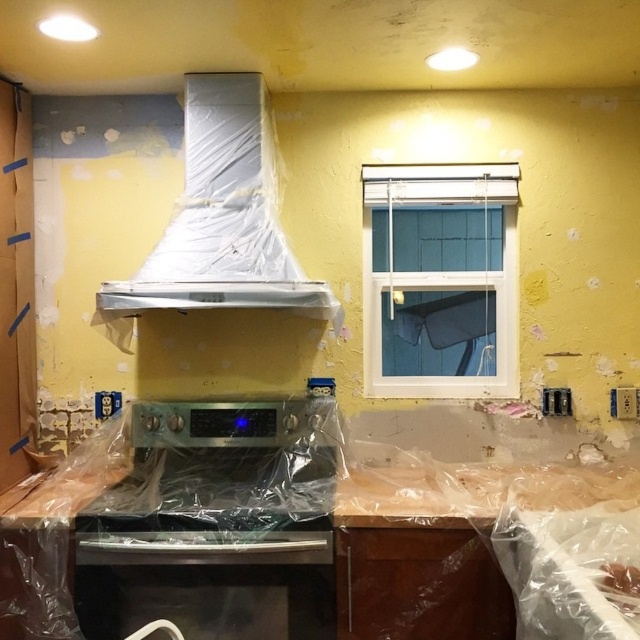
How far apart are satin silver oven at center and white plastic exhaust hood at upper center?

satin silver oven at center is 24.79 inches away from white plastic exhaust hood at upper center.

Which of these two, satin silver oven at center or white plastic exhaust hood at upper center, stands shorter?

Standing shorter between the two is satin silver oven at center.

The height and width of the screenshot is (640, 640). Describe the element at coordinates (216, 524) in the screenshot. I see `satin silver oven at center` at that location.

I want to click on satin silver oven at center, so tap(216, 524).